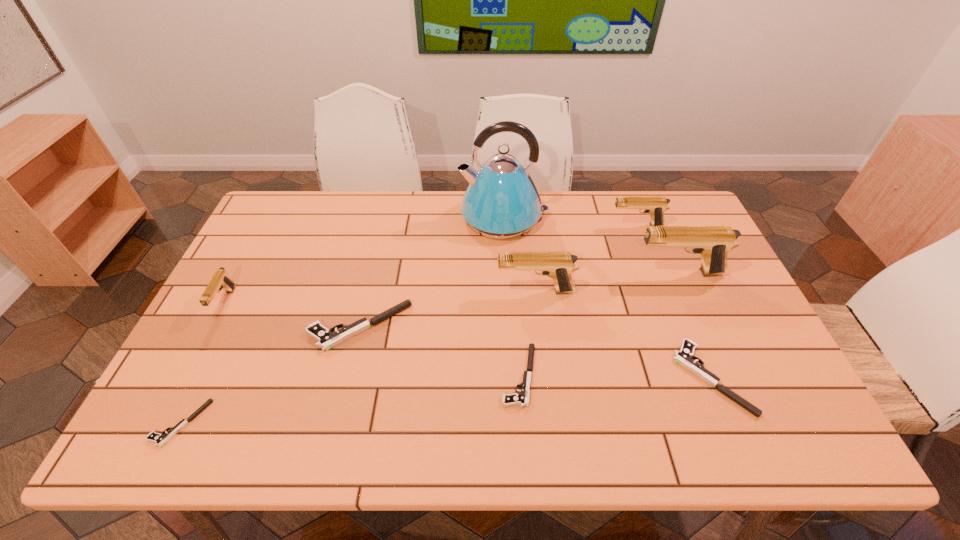
This screenshot has height=540, width=960. Find the location of `the third black pistol from right to left`. the third black pistol from right to left is located at coordinates (326, 338).

Find the location of `the sixth tallest pistol`. the sixth tallest pistol is located at coordinates (684, 357).

At what (x,y) coordinates should I click in order to perform the action: click on the second biggest black pistol. Please return your answer as a coordinate pair (x, y). Image resolution: width=960 pixels, height=540 pixels. Looking at the image, I should click on (684, 357).

This screenshot has width=960, height=540. Identify the location of the eighth tallest object. (522, 398).

Image resolution: width=960 pixels, height=540 pixels. Find the location of `the second shortest pistol`. the second shortest pistol is located at coordinates (522, 398).

This screenshot has height=540, width=960. What are the coordinates of `the leftmost black pistol` in the screenshot? It's located at (160, 439).

Identify the location of the smallest black pistol. The image size is (960, 540). (160, 439).

Identify the location of free region located at the spout of the kettle. This screenshot has width=960, height=540. (363, 217).

Find the location of `blank space located at the spout of the kettle`. blank space located at the spout of the kettle is located at coordinates (374, 217).

Where is `vacant point located at the spout of the kettle`? Image resolution: width=960 pixels, height=540 pixels. vacant point located at the spout of the kettle is located at coordinates (366, 217).